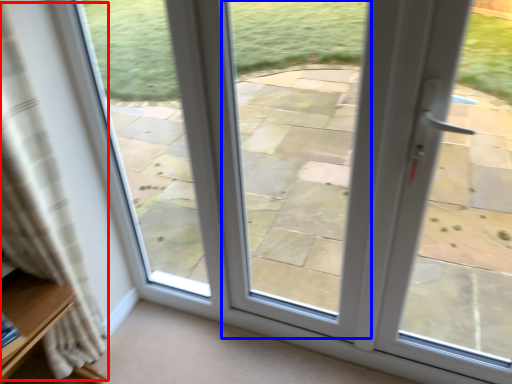
Question: Which object appears closest to the camera in this image, curtain (highlighted by a red box) or window (highlighted by a blue box)?

Choices:
 (A) curtain
 (B) window

Answer: (A)